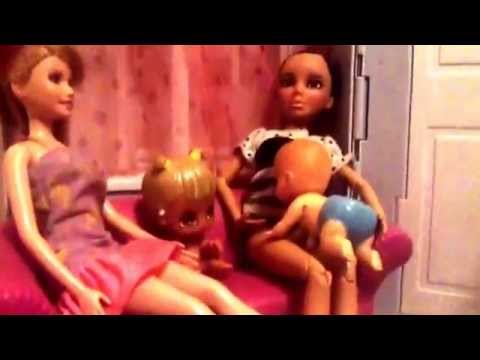
The height and width of the screenshot is (360, 480). I want to click on white lady doll, so click(x=46, y=138).